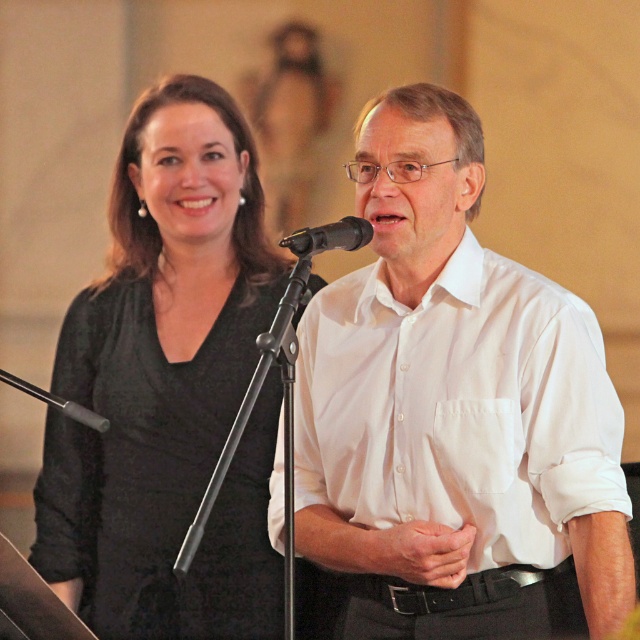
You are a photographer adjusting your camera settings. You notice two points in the image at coordinates point [113,280] and point [362,228]. Which point is closer to your camera lens?

Point [113,280] is further to the camera than point [362,228], so the point closer to the camera lens is point [362,228].

You are a photographer adjusting your camera settings. You notice two points in the scene at coordinates point (x=422, y=172) and point (x=314, y=243). Which point is closer to your camera lens?

Point (x=314, y=243) is closer to the camera lens because it is positioned nearer than point (x=422, y=172), which is further away.

You are a photographer adjusting your camera settings to capture the scene. You need to focus on the black matte dress at left and the black matte microphone at center. Which object should you prioritize focusing on first to ensure clarity?

The black matte dress at left should be prioritized for focus first since it is closer to the viewer than the black matte microphone at center, making it more likely to be in sharp focus if the depth of field is limited.